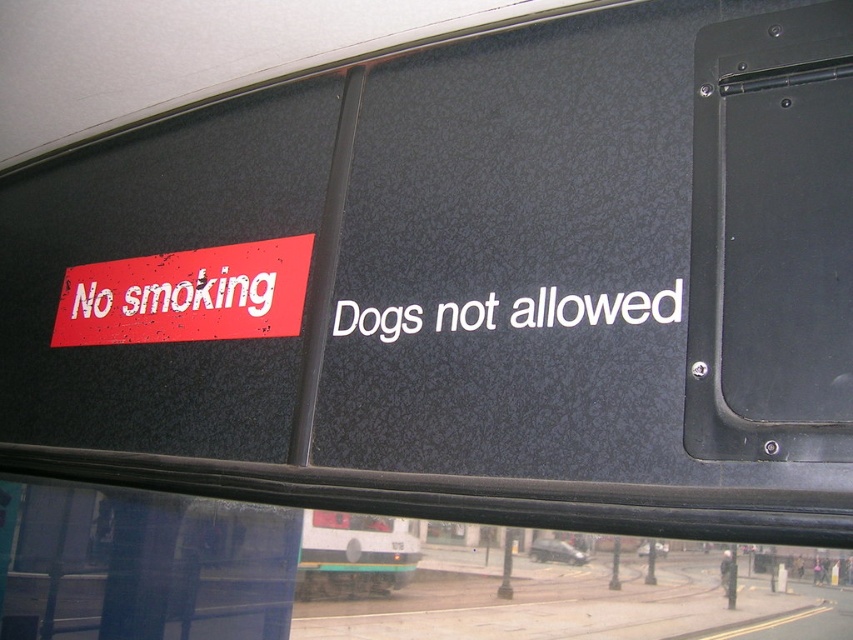
Question: Which point is farther to the camera?

Choices:
 (A) red matte sign at upper left
 (B) white plastic bus at lower center
 (C) white plastic text at center

Answer: (B)

Question: Does white plastic text at center appear under white plastic bus at lower center?

Choices:
 (A) yes
 (B) no

Answer: (B)

Question: Among these points, which one is farthest from the camera?

Choices:
 (A) (178, 294)
 (B) (462, 308)

Answer: (A)

Question: From the image, what is the correct spatial relationship of white plastic text at center in relation to white plastic bus at lower center?

Choices:
 (A) right
 (B) left

Answer: (A)

Question: Which object is positioned closest to the white plastic bus at lower center?

Choices:
 (A) white plastic text at center
 (B) red matte sign at upper left

Answer: (B)

Question: Does white plastic text at center come behind white plastic bus at lower center?

Choices:
 (A) no
 (B) yes

Answer: (A)